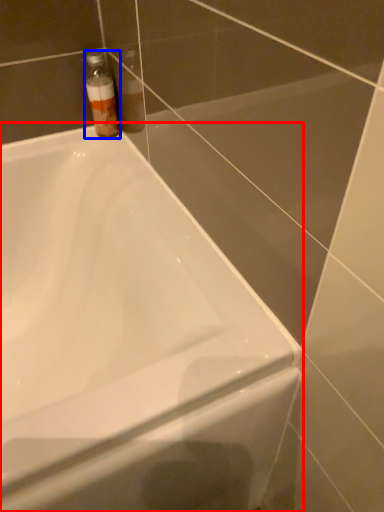
Question: Which object is further to the camera taking this photo, bathtub (highlighted by a red box) or bottle (highlighted by a blue box)?

Choices:
 (A) bathtub
 (B) bottle

Answer: (B)